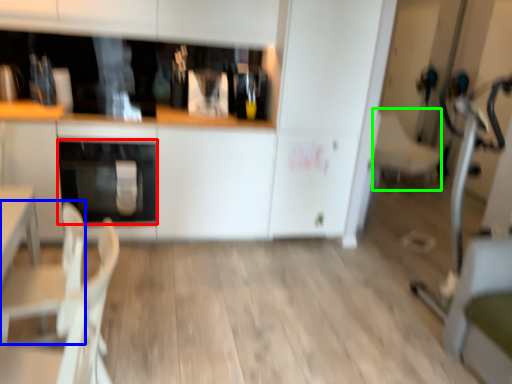
Question: Considering the real-world distances, which object is farthest from oven (highlighted by a red box)? armchair (highlighted by a blue box) or armchair (highlighted by a green box)?

Choices:
 (A) armchair
 (B) armchair

Answer: (B)